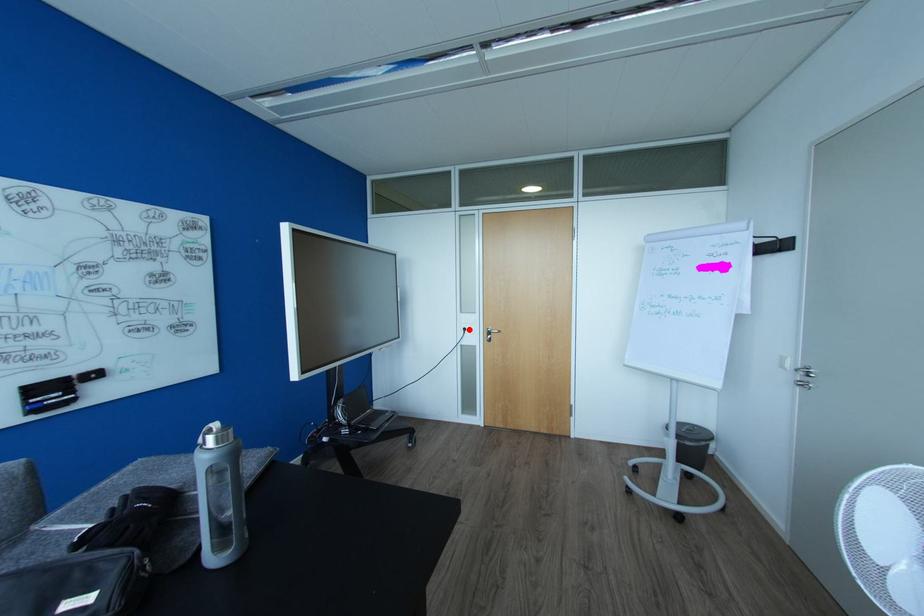
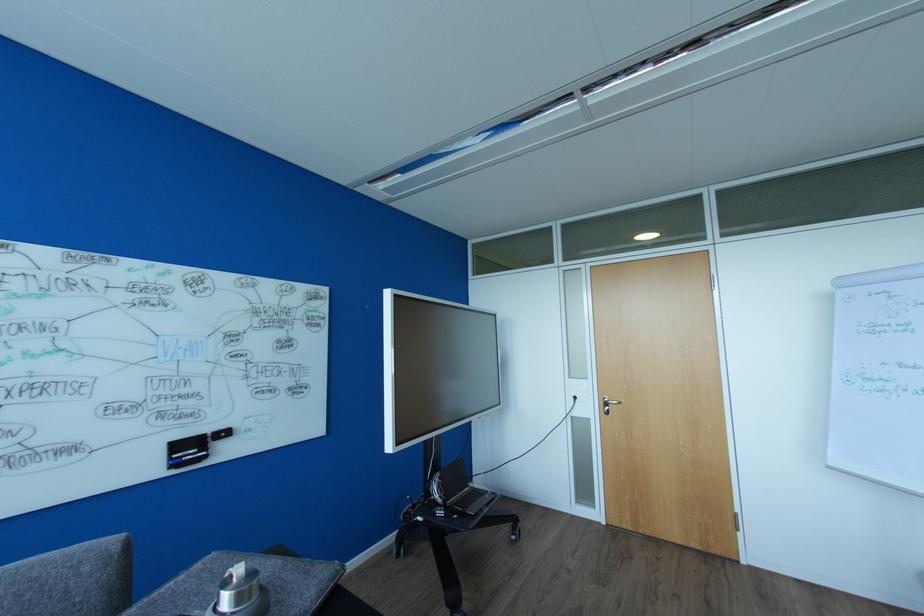
The point at the highlighted location is marked in the first image. Where is the corresponding point in the second image?

(578, 398)